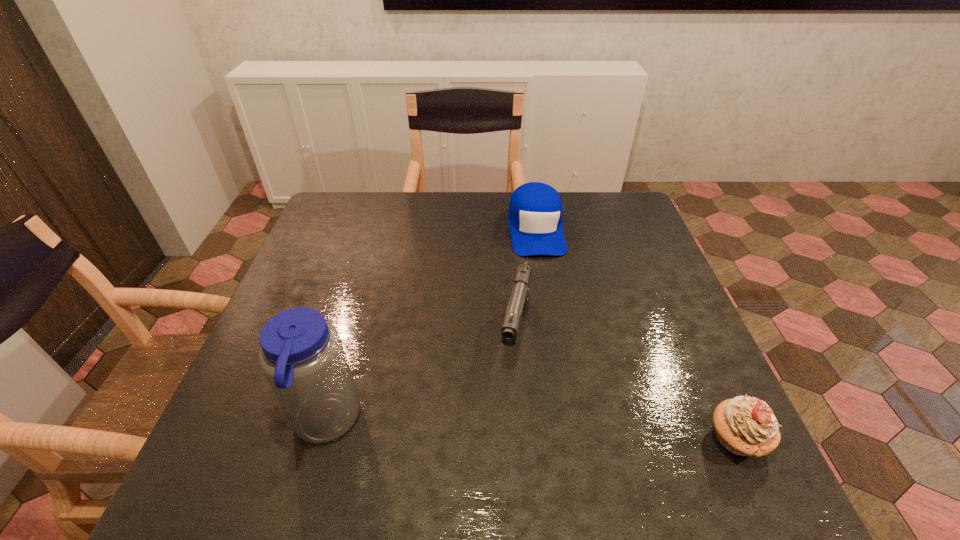
The width and height of the screenshot is (960, 540). I want to click on the tallest object, so click(x=302, y=357).

At what (x,y) coordinates should I click in order to perform the action: click on water bottle. Please return your answer as a coordinate pair (x, y). Looking at the image, I should click on (302, 357).

Where is `cupcake`? cupcake is located at coordinates (745, 426).

Locate an element on the screen. the third nearest object is located at coordinates 517,305.

Locate an element on the screen. The height and width of the screenshot is (540, 960). baseball cap is located at coordinates (535, 209).

Where is `vacant space located 0.100m on the left of the rightmost object`? vacant space located 0.100m on the left of the rightmost object is located at coordinates (656, 439).

The image size is (960, 540). Identify the location of free space located in the direction the gun is aimed. (509, 395).

Where is `free region located 0.090m in the direction the gun is aimed`? Image resolution: width=960 pixels, height=540 pixels. free region located 0.090m in the direction the gun is aimed is located at coordinates (506, 407).

I want to click on free region located 0.160m in the direction the gun is aimed, so click(499, 438).

Find the location of a particular element. This screenshot has width=960, height=540. blank space located on the front-facing side of the baseball cap is located at coordinates (552, 324).